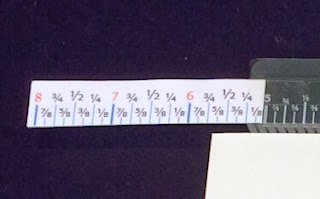
Identify the location of white piece of paper with measurements in inches. (105, 89).